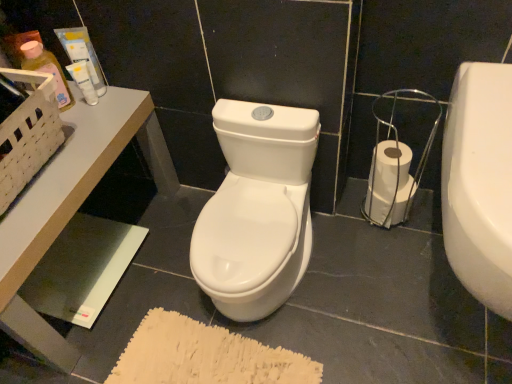
Locate an element on the screen. This screenshot has height=384, width=512. free spot in front of white matte tube at upper left, arranged as the 3th toiletry when viewed from the left is located at coordinates (79, 145).